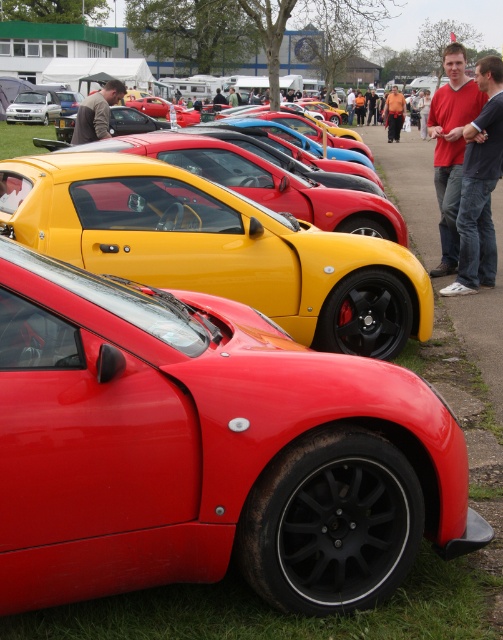
Which of these two, glossy red sports car at lower left or matte red shirt at right, stands taller?

glossy red sports car at lower left is taller.

Which is more to the left, glossy red sports car at lower left or matte red shirt at right?

glossy red sports car at lower left is more to the left.

This screenshot has width=503, height=640. I want to click on glossy red sports car at lower left, so click(208, 451).

Does glossy red sports car at lower left have a larger size compared to orange fabric person at center?

Actually, glossy red sports car at lower left might be smaller than orange fabric person at center.

Is glossy red sports car at lower left thinner than orange fabric person at center?

Correct, glossy red sports car at lower left's width is less than orange fabric person at center's.

Is point (443, 550) behind point (399, 97)?

No, it is in front of (399, 97).

You are a GUI agent. You are given a task and a screenshot of the screen. Output one action in this format:
    pyautogui.click(x=<x>, y=<y>)
    Task: Click on the glossy red sports car at lower left
    This screenshot has height=640, width=503.
    Given the screenshot: What is the action you would take?
    pyautogui.click(x=208, y=451)

Does glossy red sports car at lower left have a greater height compared to matte black sports car at center?

In fact, glossy red sports car at lower left may be shorter than matte black sports car at center.

Who is taller, glossy red sports car at lower left or matte black sports car at center?

With more height is matte black sports car at center.

Which is behind, point (450, 474) or point (194, 262)?

The point (194, 262) is behind.

Locate an element on the screen. glossy red sports car at lower left is located at coordinates 208,451.